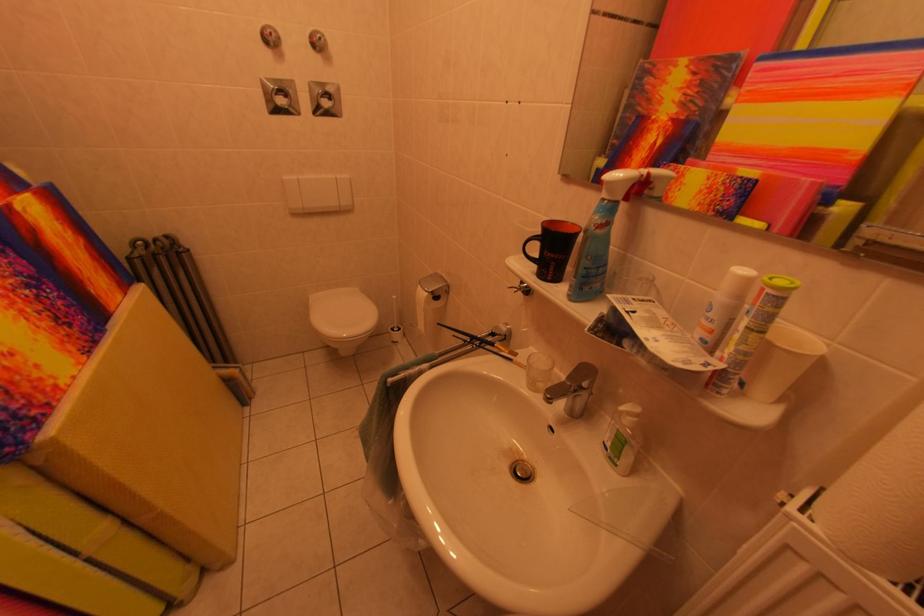
Where would you press the white spray can nozzle? Please return your answer as a coordinate pair (x, y).

(582, 200)